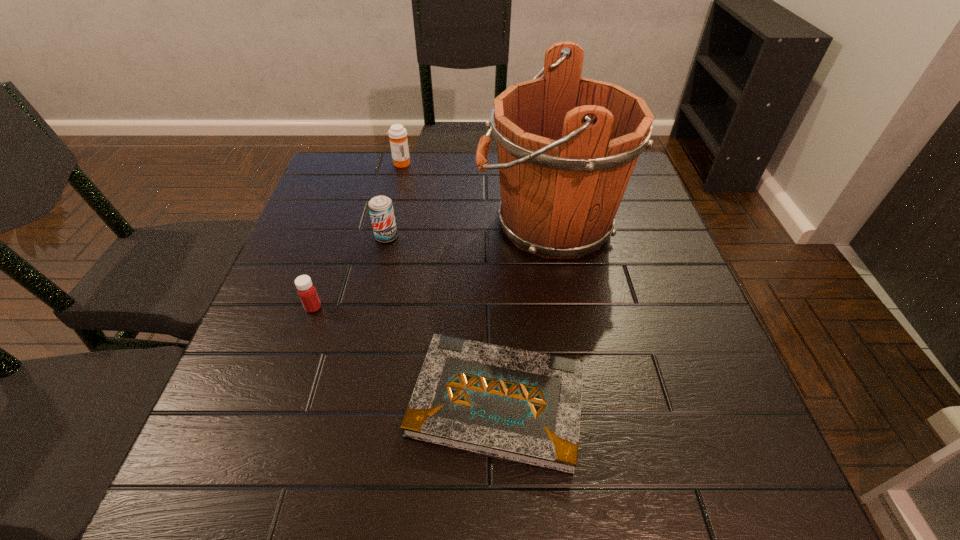
Where is `the tallest object`? the tallest object is located at coordinates (567, 146).

The width and height of the screenshot is (960, 540). In order to click on the right medicine in this screenshot , I will do `click(398, 134)`.

Where is `the farther medicine`? the farther medicine is located at coordinates (398, 134).

The width and height of the screenshot is (960, 540). I want to click on beer can, so click(x=381, y=210).

Where is `the fourth tallest object`? the fourth tallest object is located at coordinates (307, 292).

You are a GUI agent. You are given a task and a screenshot of the screen. Output one action in this format:
    pyautogui.click(x=<x>, y=<y>)
    Task: Click on the shorter medicine
    
    Given the screenshot: What is the action you would take?
    pyautogui.click(x=307, y=292)

The width and height of the screenshot is (960, 540). In order to click on the shortest object in this screenshot , I will do `click(522, 406)`.

Locate an element on the screen. notebook is located at coordinates (522, 406).

Identify the location of vacant space located with the handle on the side of the bucket. (398, 224).

Locate an element on the screen. free space located with the handle on the side of the bucket is located at coordinates (457, 224).